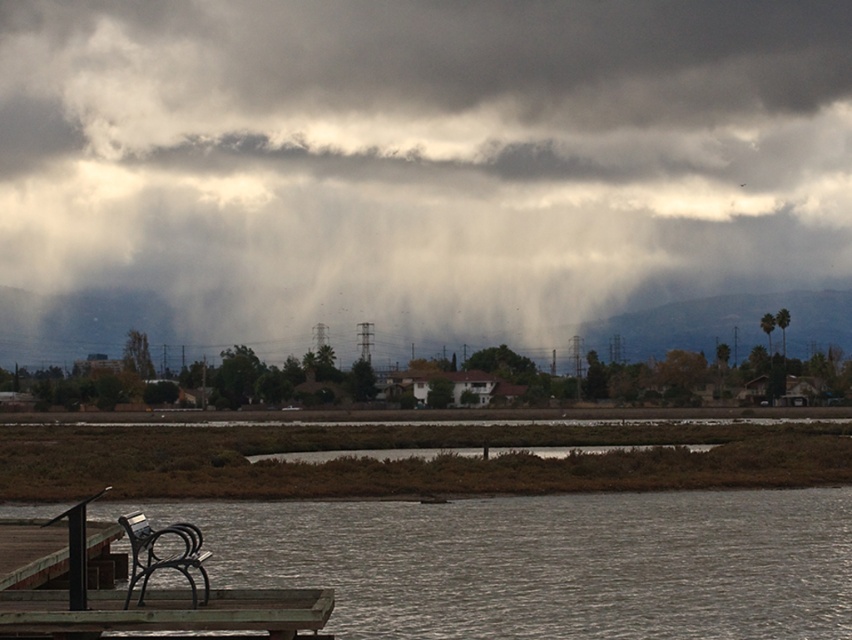
Question: Does wooden dock at lower left have a larger size compared to metallic park bench at lower left?

Choices:
 (A) no
 (B) yes

Answer: (B)

Question: Does dark gray cloud at upper center appear over wooden dock at lower left?

Choices:
 (A) yes
 (B) no

Answer: (A)

Question: Does wooden dock at lower left appear on the right side of metallic park bench at lower left?

Choices:
 (A) no
 (B) yes

Answer: (A)

Question: Which point is closer to the camera taking this photo?

Choices:
 (A) (39, 205)
 (B) (131, 586)
 (C) (617, 525)

Answer: (B)

Question: Which object appears closest to the camera in this image?

Choices:
 (A) dark gray cloud at upper center
 (B) wooden dock at lower left

Answer: (B)

Question: Based on their relative distances, which object is nearer to the brown wooden picnic table at lower left?

Choices:
 (A) wooden dock at lower left
 (B) dark gray cloud at upper center

Answer: (A)